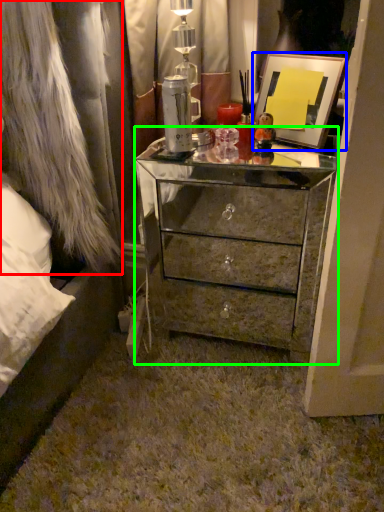
Question: Estimate the real-world distances between objects in this image. Which object is closer to fur coat (highlighted by a red box), picture frame (highlighted by a blue box) or chest of drawers (highlighted by a green box)?

Choices:
 (A) picture frame
 (B) chest of drawers

Answer: (B)